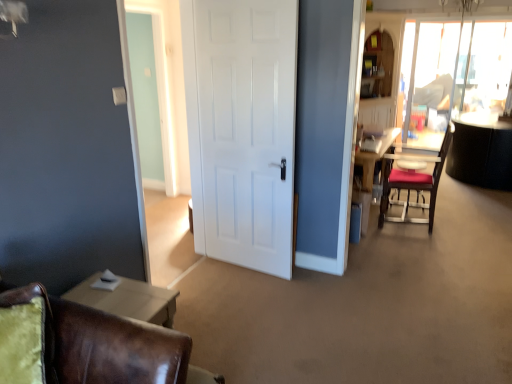
Find the location of a particular element. free location in front of white matte door at center is located at coordinates (252, 301).